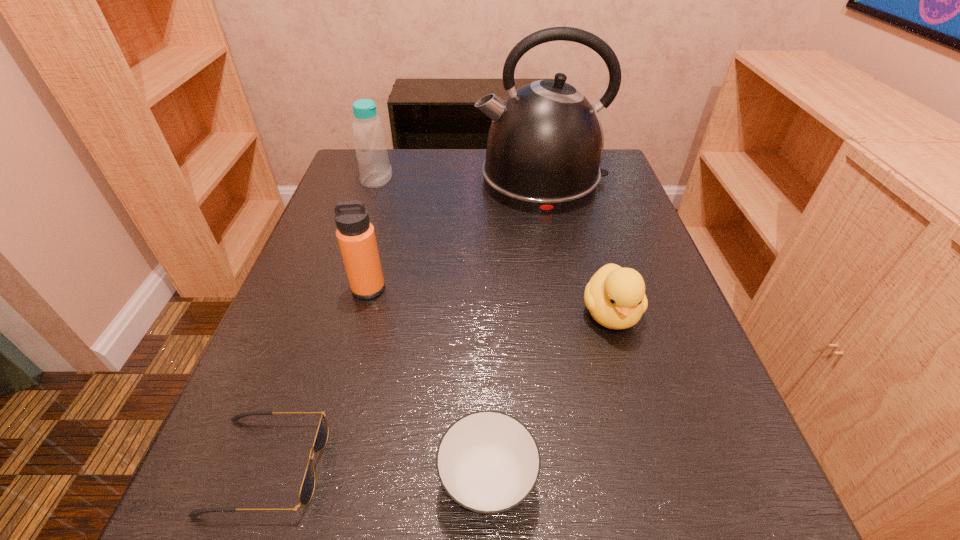
At what (x,y) coordinates should I click in order to perform the action: click on vacant space located on the back of the thermos bottle. Please return your answer as a coordinate pair (x, y). The height and width of the screenshot is (540, 960). Looking at the image, I should click on coord(381,239).

Identify the location of vacant space positioned 0.180m on the front-facing side of the duck. Image resolution: width=960 pixels, height=540 pixels. (649, 445).

Find the location of `vacant space located on the back of the soup bowl`. vacant space located on the back of the soup bowl is located at coordinates tap(485, 267).

The image size is (960, 540). In order to click on free location located 0.370m on the front-facing side of the sunglasses in this screenshot , I will do click(x=596, y=465).

Where is `kettle that is positioned at the far edge`? The image size is (960, 540). kettle that is positioned at the far edge is located at coordinates (545, 143).

This screenshot has width=960, height=540. I want to click on bottle that is positioned at the far edge, so click(370, 144).

Where is `soup bowl present at the near edge`? soup bowl present at the near edge is located at coordinates (488, 462).

You are a GUI agent. You are given a task and a screenshot of the screen. Output one action in this format:
    pyautogui.click(x=<x>, y=<y>)
    Task: Click on the sunglasses that is at the near edge
    
    Given the screenshot: What is the action you would take?
    pyautogui.click(x=307, y=487)

The height and width of the screenshot is (540, 960). Identify the location of bottle situated at the left edge. (370, 144).

Locate an element on the screen. This screenshot has height=540, width=960. thermos bottle that is at the left edge is located at coordinates (355, 234).